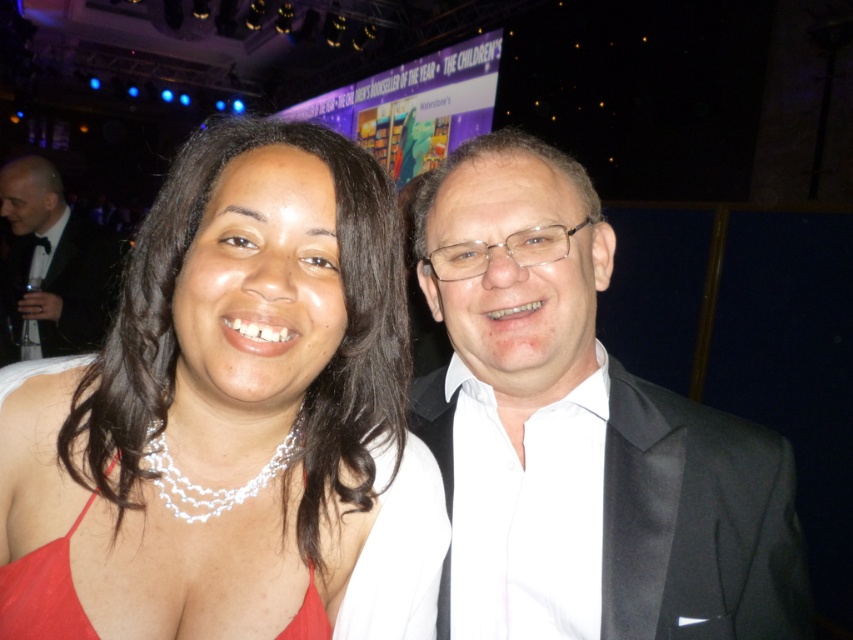
Consider the image. You are standing at the point marked as point [93,401] and want to take a photo of the banner. The camera you have can focus on objects within 25 inches. Can you take a clear photo of the banner without moving?

The distance between point [93,401] and the camera is 24.42 inches, which is within the camera focus range of 25 inches. Therefore, you can take a clear photo of the banner without moving.

You are a photographer at a formal event and need to adjust the camera focus. The black tuxedo at left and the red satin dress at center are both in the frame. Which one is taller?

The black tuxedo at left is taller than the red satin dress at center.

You are at a formal event and need to locate the black tuxedo at left and the red satin dress at center. According to the scene, which object is positioned to the left of the other?

The black tuxedo at left is positioned to the left of the red satin dress at center.